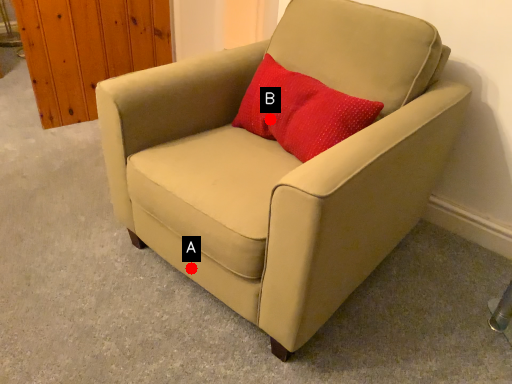
Question: Two points are circled on the image, labeled by A and B beside each circle. Among these points, which one is farthest from the camera?

Choices:
 (A) A is further
 (B) B is further

Answer: (B)